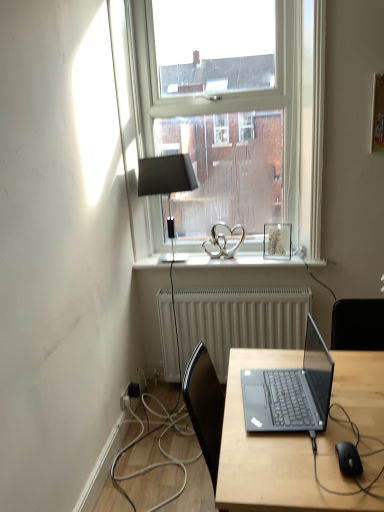
The width and height of the screenshot is (384, 512). In order to click on free location to the right of sleek black laptop at center in this screenshot , I will do `click(347, 389)`.